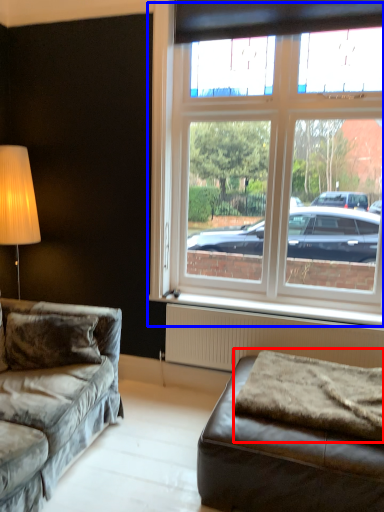
Question: Which object is closer to the camera taking this photo, blanket (highlighted by a red box) or window (highlighted by a blue box)?

Choices:
 (A) blanket
 (B) window

Answer: (A)